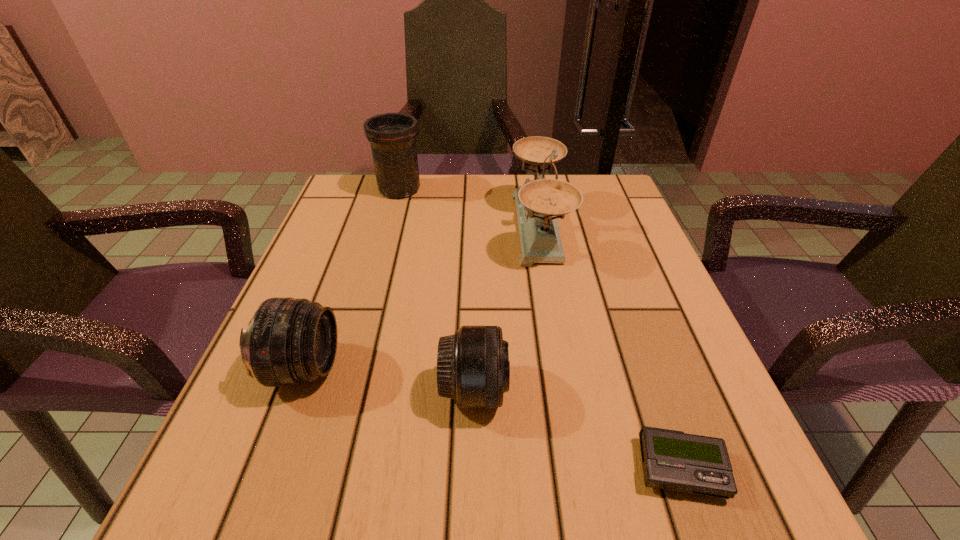
Where is `the second object from right to left`? This screenshot has height=540, width=960. the second object from right to left is located at coordinates (539, 203).

You are a GUI agent. You are given a task and a screenshot of the screen. Output one action in this format:
    pyautogui.click(x=<x>, y=<y>)
    Task: Click on the farthest telephoto lens
    This screenshot has height=540, width=960.
    Given the screenshot: What is the action you would take?
    pyautogui.click(x=392, y=136)

The width and height of the screenshot is (960, 540). I want to click on the third object from right to left, so click(473, 368).

Locate an element on the screen. The width and height of the screenshot is (960, 540). beeper is located at coordinates (672, 460).

Image resolution: width=960 pixels, height=540 pixels. I want to click on the nearest object, so click(672, 460).

I want to click on vacant region located on the front-facing side of the scale, so click(x=407, y=228).

Locate an element on the screen. This screenshot has width=960, height=540. vacant region located 0.270m on the front-facing side of the scale is located at coordinates (395, 228).

I want to click on vacant space located on the front-facing side of the scale, so point(403,228).

I want to click on free spot located 0.350m on the front of the tallest telephoto lens, so click(370, 299).

I want to click on vacant space situated 0.280m on the front-facing side of the rightmost telephoto lens, so click(686, 390).